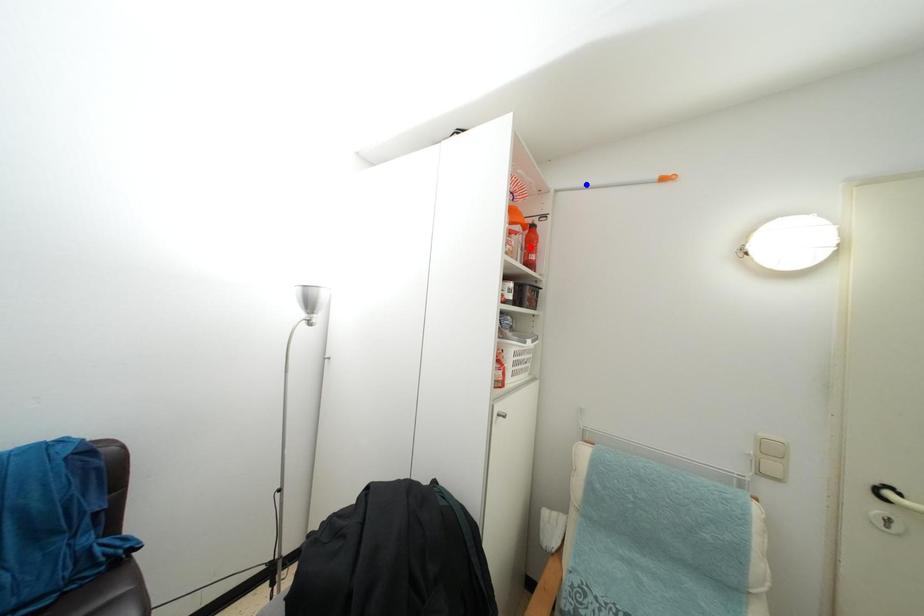
Question: In the image, two points are highlighted. Which point is nearer to the camera? Reply with the corresponding letter.

Choices:
 (A) blue point
 (B) red point

Answer: (A)